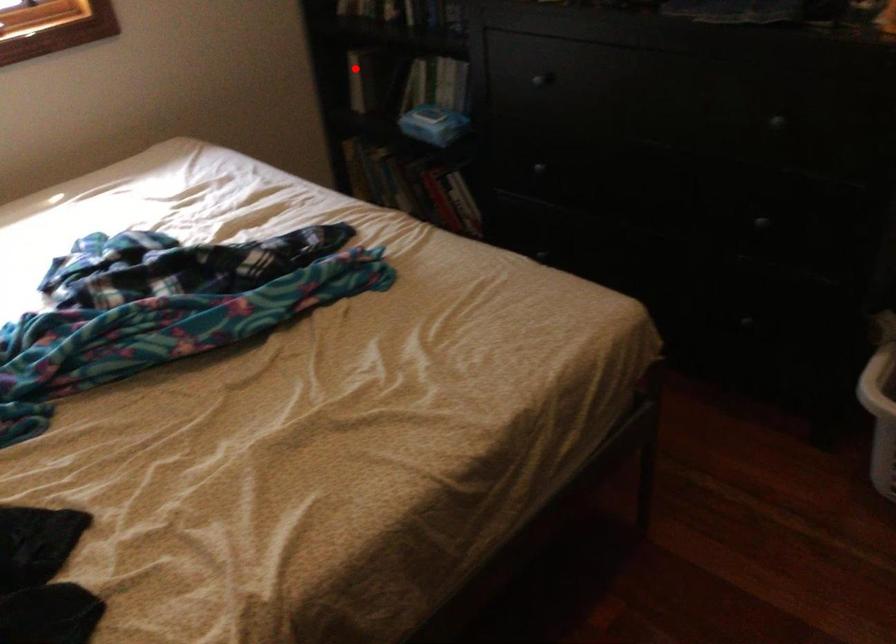
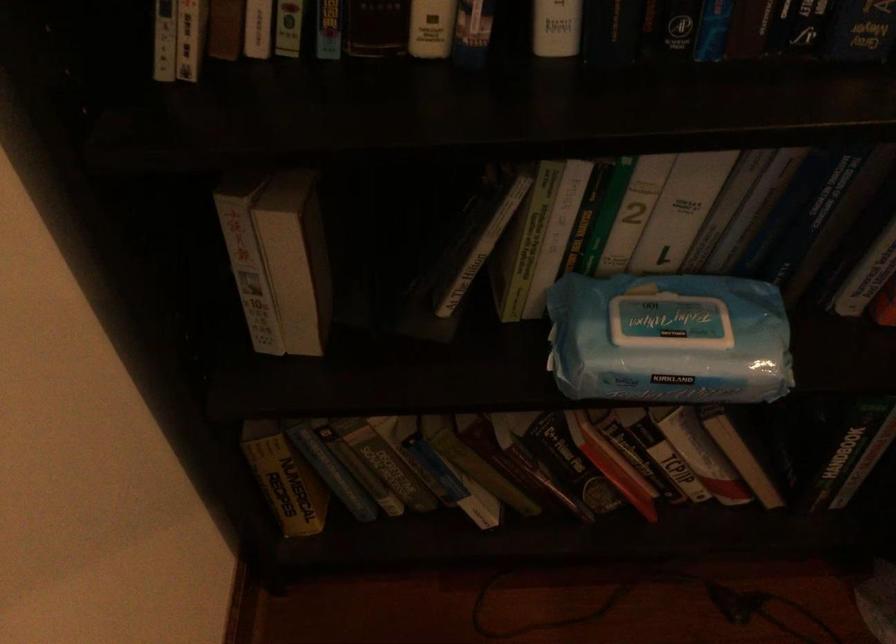
Where in the second image is the point corresponding to the highlighted location from the first image?

(296, 259)